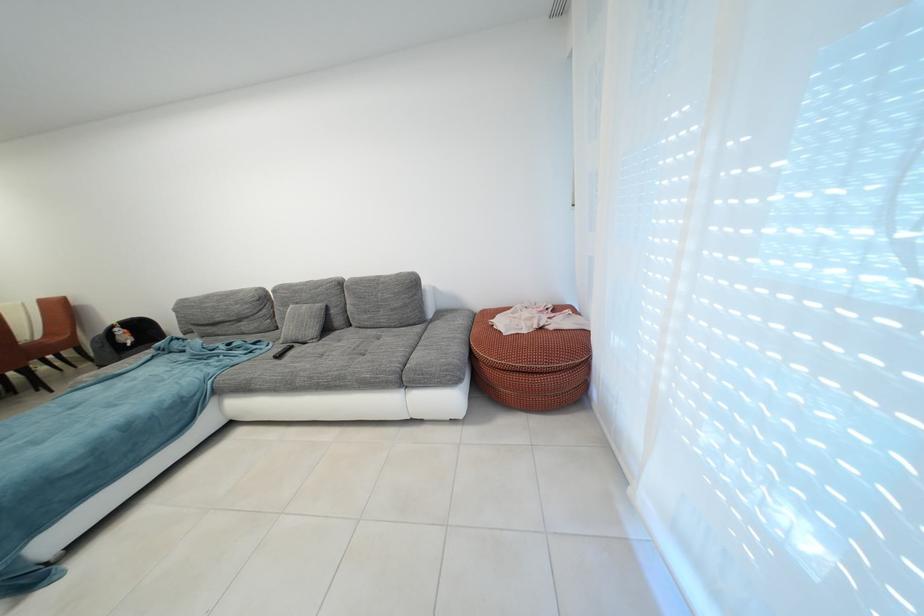
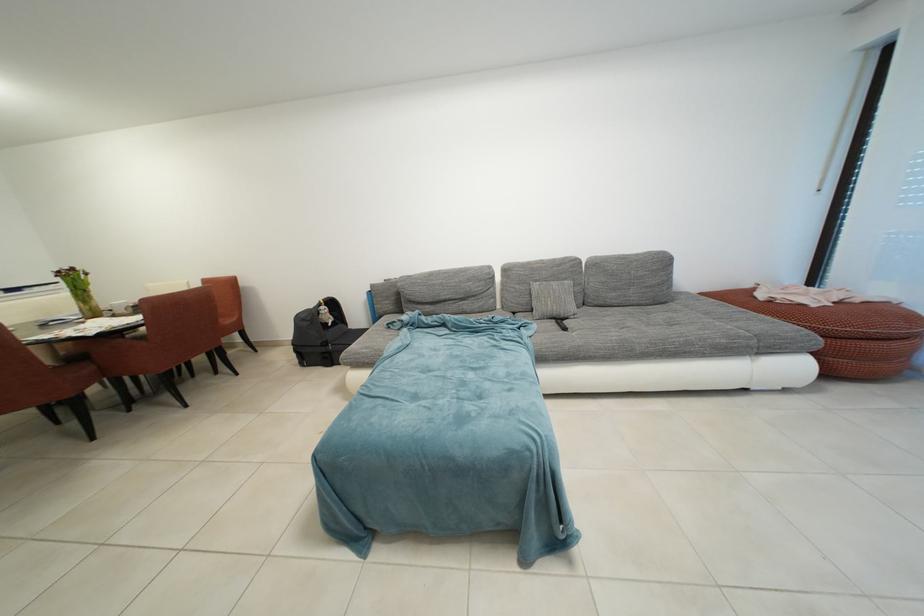
The point at (256, 322) is marked in the first image. Where is the corresponding point in the second image?

(482, 301)